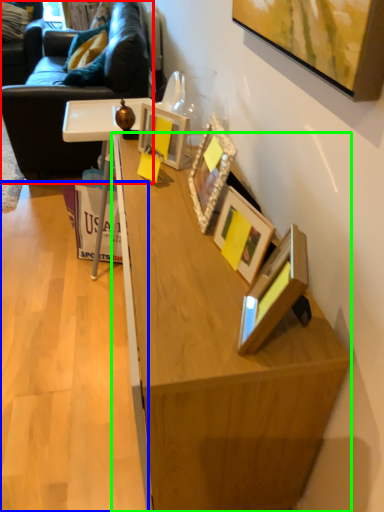
Question: Based on their relative distances, which object is farther from studio couch (highlighted by a red box)? Choose from plywood (highlighted by a blue box) and desk (highlighted by a green box).

Choices:
 (A) plywood
 (B) desk

Answer: (B)